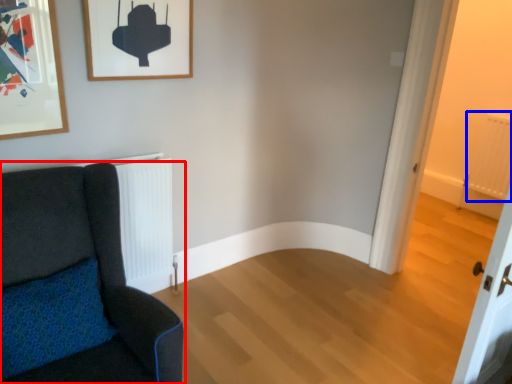
Question: Which point is further to the camera, chair (highlighted by a red box) or radiator (highlighted by a blue box)?

Choices:
 (A) chair
 (B) radiator

Answer: (B)